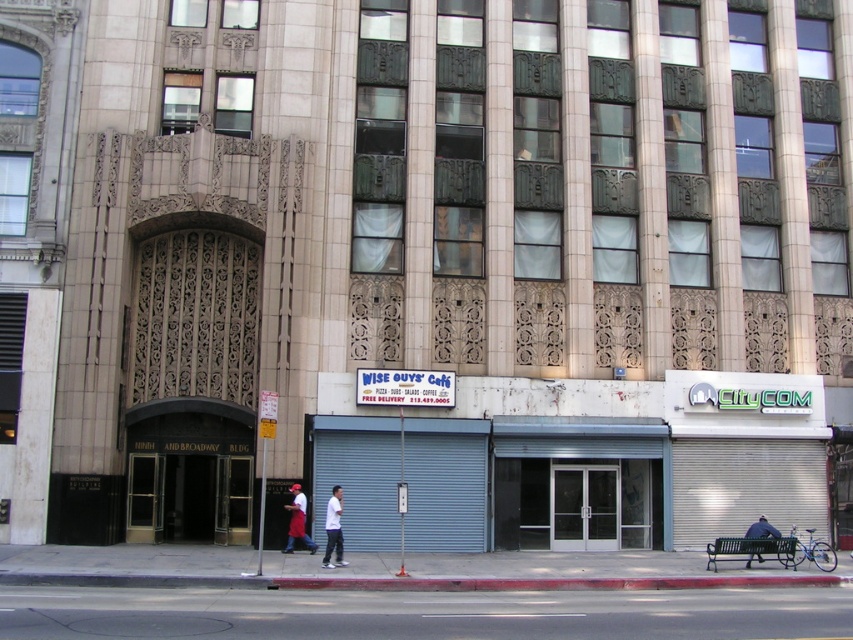
You are a delivery person trying to locate the entrance of the Ninth and Broadway Building. You see a white matte shirt at center and a blue fabric jacket at lower right. Which of these two items is closer to the entrance?

The white matte shirt at center is closer to the entrance because it is in front of the blue fabric jacket at lower right, indicating it is nearer to the entrance.

You are a delivery person standing at the entrance of the Ninth and Broadway Building. You need to place a package on the smooth asphalt road at lower center and the red apron at center. Which location is farther from your current position?

The smooth asphalt road at lower center is farther from your current position because it is 8.87 meters away from the red apron at center, which is closer.

You are a delivery person standing at the entrance of the Ninth and Broadway Building. You need to place a large package on the smooth asphalt road at lower center or the red apron at center. Which surface can accommodate the package without it hanging over the edges?

The smooth asphalt road at lower center has a larger size compared to the red apron at center, so the package can be placed on the smooth asphalt road at lower center without hanging over the edges.